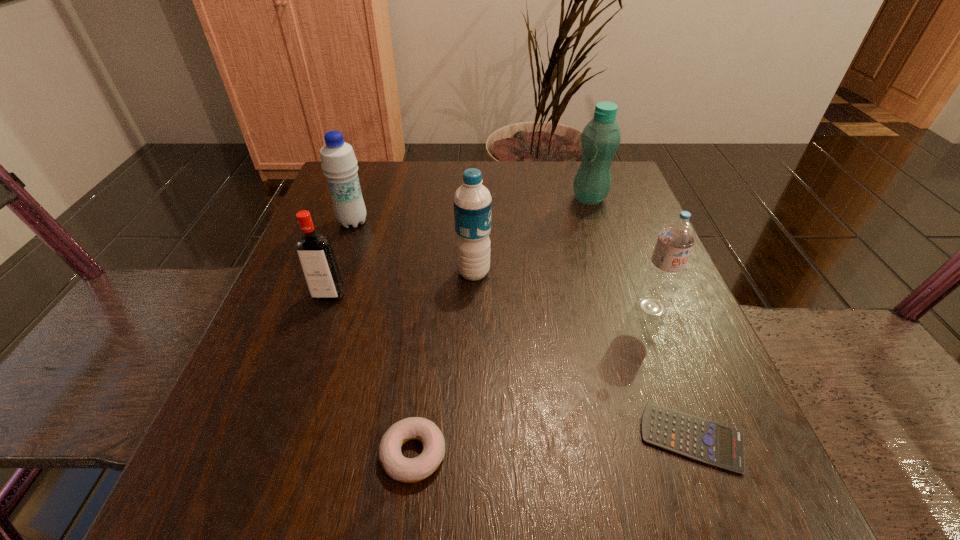
The width and height of the screenshot is (960, 540). Identify the location of empty location between the fourth object from right to left and the second farthest object. (413, 247).

At what (x,y) coordinates should I click in order to perform the action: click on free space between the vodka and the fifth object from right to left. Please return your answer as a coordinate pair (x, y). The image size is (960, 540). Looking at the image, I should click on (372, 374).

At what (x,y) coordinates should I click in order to perform the action: click on free area in between the vodka and the leftmost water bottle. Please return your answer as a coordinate pair (x, y). Looking at the image, I should click on (341, 259).

The height and width of the screenshot is (540, 960). I want to click on free area in between the doughnut and the fourth object from left to right, so click(x=444, y=363).

I want to click on object that can be found as the fourth closest to the vodka, so click(x=697, y=438).

Identify which object is the sixth nearest to the vodka. Please provide its 2D coordinates. Your answer should be formatted as a tuple, i.e. [(x, y)], where the tuple contains the x and y coordinates of a point satisfying the conditions above.

[(600, 139)]

This screenshot has height=540, width=960. Identify the location of water bottle that is the second closest to the calculator. (472, 201).

Choose which water bottle is the fourth nearest neighbor to the vodka. Please provide its 2D coordinates. Your answer should be formatted as a tuple, i.e. [(x, y)], where the tuple contains the x and y coordinates of a point satisfying the conditions above.

[(600, 139)]

Identify the location of vacant position in the image that satisfies the following two spatial constraints: 1. at the front cap of the farthest water bottle; 2. on the left side of the nearest water bottle. This screenshot has width=960, height=540. (625, 307).

Where is `vacant point that satisfies the following two spatial constraints: 1. on the label of the shortest object; 2. on the right side of the second nearest water bottle`? The width and height of the screenshot is (960, 540). vacant point that satisfies the following two spatial constraints: 1. on the label of the shortest object; 2. on the right side of the second nearest water bottle is located at coordinates (471, 438).